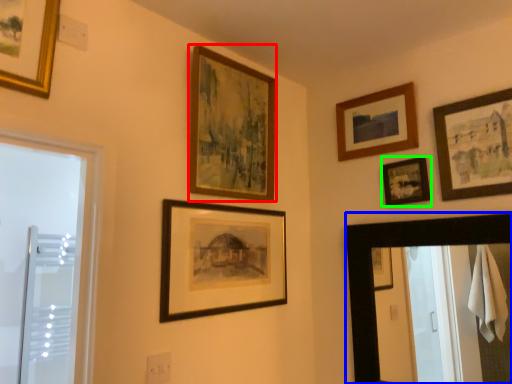
Question: Estimate the real-world distances between objects in this image. Which object is closer to picture frame (highlighted by a red box), mirror (highlighted by a blue box) or picture frame (highlighted by a green box)?

Choices:
 (A) mirror
 (B) picture frame

Answer: (B)